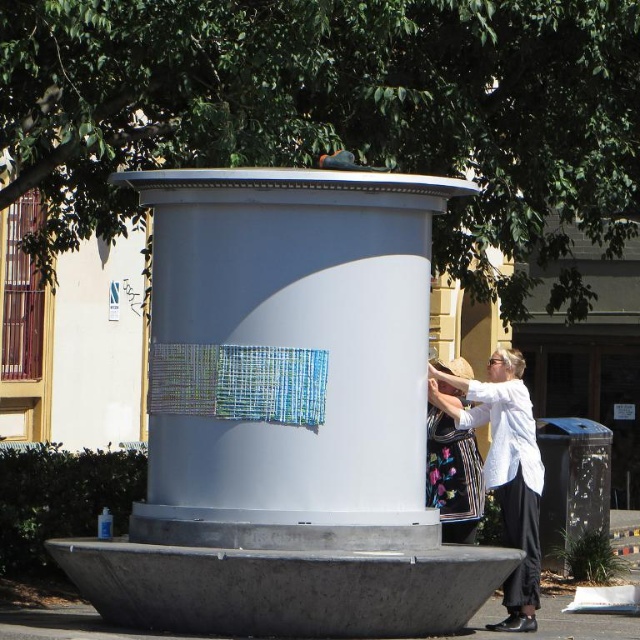
From the picture: You are at a park and see the white matte fountain at center and the white cotton shirt at center. Which object is bigger?

The white matte fountain at center is larger in size compared to the white cotton shirt at center.